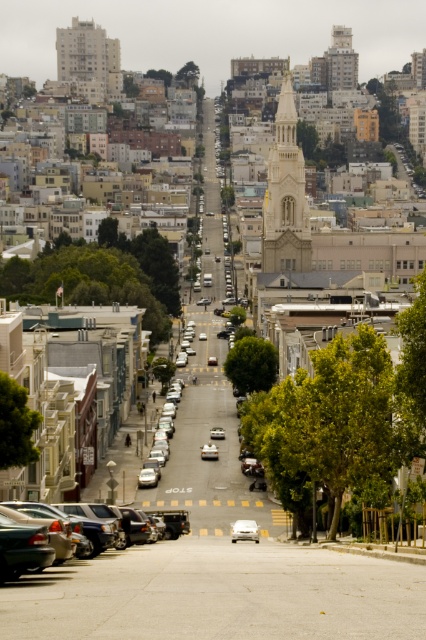
You are a city planner assessing the street layout. Given the gray concrete building at upper left and the white matte car at center, which one has a greater width?

The gray concrete building at upper left has a greater width than the white matte car at center according to the description.

You are a drone operator planning to fly a drone from the gray concrete building at upper left to the gold textured tower at center. Considering the height difference, will the drone need to ascend or descend to reach its destination?

The gold textured tower at center is much taller than the gray concrete building at upper left, so the drone will need to ascend to reach its destination.

You are a delivery driver needing to park your vehicle in the parking lot near the church. You see a matte black sedan at lower left and a white glossy car at center. Which car is blocking your path to the parking spot?

The matte black sedan at lower left is blocking your path to the parking spot because it is in front of the white glossy car at center, which suggests it is closer to your current position.